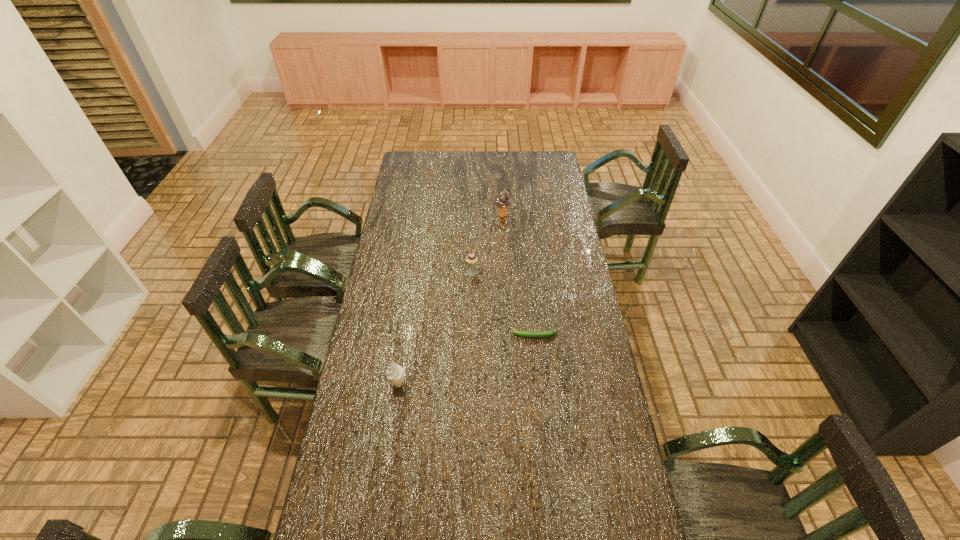
This screenshot has width=960, height=540. What are the coordinates of `the farthest icecream` in the screenshot? It's located at (503, 201).

Locate an element on the screen. This screenshot has width=960, height=540. the farthest object is located at coordinates (503, 201).

This screenshot has width=960, height=540. In order to click on the leftmost icecream in this screenshot , I will do `click(395, 373)`.

Locate an element on the screen. the nearest object is located at coordinates (395, 373).

Image resolution: width=960 pixels, height=540 pixels. Find the location of `the second icecream from left to right`. the second icecream from left to right is located at coordinates (471, 259).

Where is `the third object from right to left`? the third object from right to left is located at coordinates (471, 259).

At what (x,y) coordinates should I click in order to perform the action: click on the second nearest object. Please return your answer as a coordinate pair (x, y). Looking at the image, I should click on (534, 334).

The image size is (960, 540). In order to click on the shortest object in this screenshot , I will do `click(534, 334)`.

Find the location of a particular element. This screenshot has width=960, height=540. vacant space located on the front of the rightmost icecream is located at coordinates (504, 239).

This screenshot has width=960, height=540. Find the location of `vacant area located 0.170m on the front-facing side of the leftmost icecream`. vacant area located 0.170m on the front-facing side of the leftmost icecream is located at coordinates (455, 384).